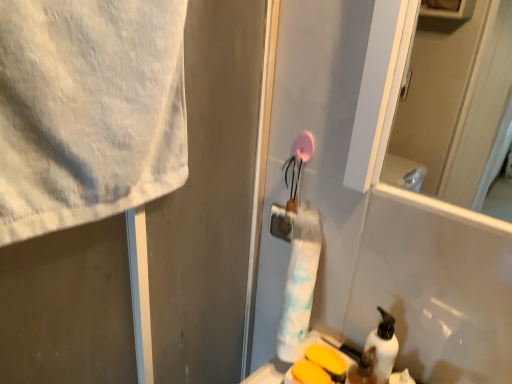
Question: Considering their positions, is white matte pump bottle at lower right located in front of or behind white matte towel at upper left?

Choices:
 (A) behind
 (B) front

Answer: (A)

Question: Considering the relative positions of white matte pump bottle at lower right and white matte towel at upper left in the image provided, is white matte pump bottle at lower right to the left or to the right of white matte towel at upper left?

Choices:
 (A) left
 (B) right

Answer: (B)

Question: Which object is positioned closest to the white matte pump bottle at lower right?

Choices:
 (A) translucent plastic soap dispenser at lower right
 (B) yellow matte soap at lower center
 (C) white matte towel at upper left

Answer: (A)

Question: Which object is the farthest from the translucent plastic soap dispenser at lower right?

Choices:
 (A) white matte towel at upper left
 (B) yellow matte soap at lower center
 (C) white matte pump bottle at lower right

Answer: (A)